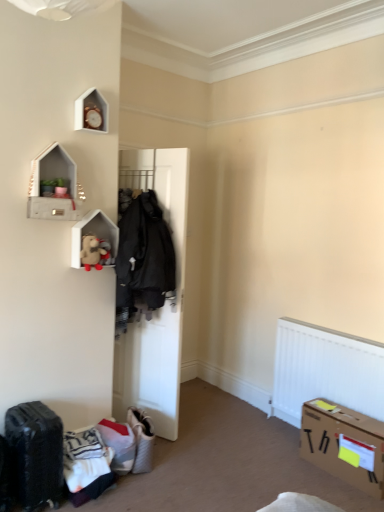
Question: From a real-world perspective, is fuzzy beige teddy bear at upper left located beneath white textured fabric suitcase at lower center, which is the 1th luggage from right to left?

Choices:
 (A) yes
 (B) no

Answer: (B)

Question: Can you confirm if fuzzy beige teddy bear at upper left is positioned to the right of white textured fabric suitcase at lower center, which is the 1th luggage from right to left?

Choices:
 (A) no
 (B) yes

Answer: (A)

Question: From the image's perspective, is fuzzy beige teddy bear at upper left located above white textured fabric suitcase at lower center, the 1th luggage positioned from the back?

Choices:
 (A) no
 (B) yes

Answer: (B)

Question: Is fuzzy beige teddy bear at upper left next to white textured fabric suitcase at lower center, the 1th luggage positioned from the back, and touching it?

Choices:
 (A) yes
 (B) no

Answer: (B)

Question: Can you confirm if fuzzy beige teddy bear at upper left is thinner than white textured fabric suitcase at lower center, which is the 2th luggage in left-to-right order?

Choices:
 (A) no
 (B) yes

Answer: (B)

Question: Does point (34, 163) appear closer or farther from the camera than point (150, 444)?

Choices:
 (A) closer
 (B) farther

Answer: (A)

Question: From the image's perspective, is concrete textured shelf at upper left, placed as the second shelf when sorted from back to front, positioned above or below white textured fabric suitcase at lower center, the 2th luggage from the front?

Choices:
 (A) above
 (B) below

Answer: (A)

Question: Considering the relative positions of concrete textured shelf at upper left, marked as the 1th shelf in a front-to-back arrangement, and white textured fabric suitcase at lower center, the 1th luggage positioned from the back, in the image provided, is concrete textured shelf at upper left, marked as the 1th shelf in a front-to-back arrangement, to the left or to the right of white textured fabric suitcase at lower center, the 1th luggage positioned from the back,?

Choices:
 (A) right
 (B) left

Answer: (B)

Question: Considering the positions of concrete textured shelf at upper left, placed as the second shelf when sorted from back to front, and white textured fabric suitcase at lower center, which is the 1th luggage from right to left, in the image, is concrete textured shelf at upper left, placed as the second shelf when sorted from back to front, bigger or smaller than white textured fabric suitcase at lower center, which is the 1th luggage from right to left,?

Choices:
 (A) big
 (B) small

Answer: (B)

Question: From the image's perspective, is white matte door at center above or below concrete textured shelf at upper left, the second shelf from the bottom?

Choices:
 (A) above
 (B) below

Answer: (B)

Question: From their relative heights in the image, would you say white matte door at center is taller or shorter than concrete textured shelf at upper left, placed as the second shelf when sorted from back to front?

Choices:
 (A) short
 (B) tall

Answer: (B)

Question: Is point (168, 382) positioned closer to the camera than point (64, 198)?

Choices:
 (A) farther
 (B) closer

Answer: (A)

Question: Considering the positions of white matte door at center and concrete textured shelf at upper left, the second shelf from the bottom, in the image, is white matte door at center wider or thinner than concrete textured shelf at upper left, the second shelf from the bottom,?

Choices:
 (A) thin
 (B) wide

Answer: (B)

Question: Is cardboard box at lower right taller or shorter than white matte door at center?

Choices:
 (A) tall
 (B) short

Answer: (B)

Question: From the image's perspective, is cardboard box at lower right positioned above or below white matte door at center?

Choices:
 (A) above
 (B) below

Answer: (B)